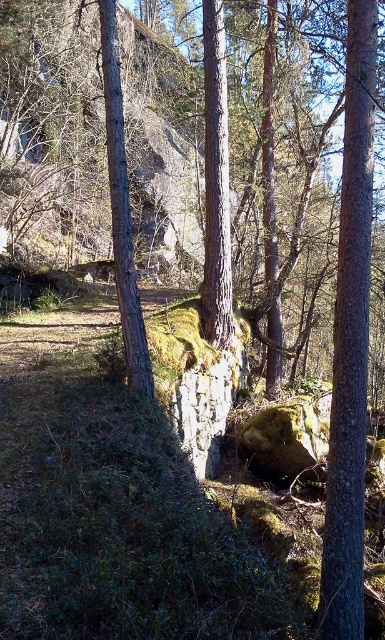
Question: Can you confirm if smooth bark tree trunk at center is thinner than smooth gray bark at center?

Choices:
 (A) no
 (B) yes

Answer: (B)

Question: Which of the following is the farthest from the observer?

Choices:
 (A) smooth bark tree trunk at center
 (B) smooth brown tree trunk at right

Answer: (A)

Question: Which point is closer to the camera taking this photo?

Choices:
 (A) (125, 196)
 (B) (212, 48)

Answer: (A)

Question: Which object is closer to the camera taking this photo?

Choices:
 (A) smooth brown tree trunk at right
 (B) smooth gray bark at center
 (C) smooth bark tree trunk at center

Answer: (A)

Question: Is smooth bark tree trunk at center positioned behind smooth gray bark at center?

Choices:
 (A) no
 (B) yes

Answer: (B)

Question: Is smooth brown tree trunk at right smaller than smooth gray bark at center?

Choices:
 (A) yes
 (B) no

Answer: (A)